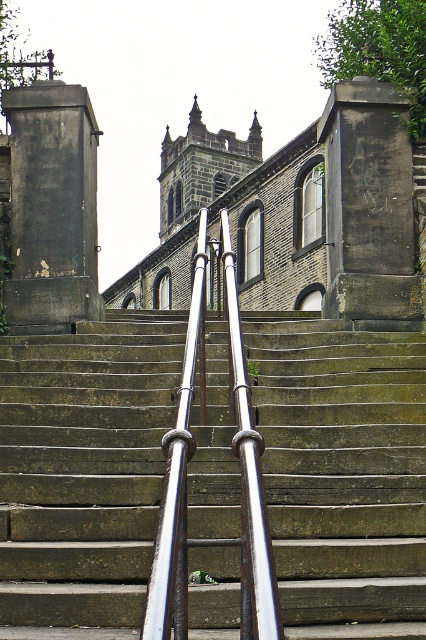
You are a painter hired to paint the rusty metal stairs at center and the silver metallic handrail at center. You have a limited amount of paint. Which object requires more paint due to its size?

The rusty metal stairs at center requires more paint because it has a larger size compared to the silver metallic handrail at center.

You are standing at the base of the historic building steps and want to reach the top. You notice two points marked on the steps. Which point, point [126,324] or point [199,308], is closer to you as you start climbing?

Point [126,324] is closer to you because it is further to the viewer than point [199,308], meaning it is nearer to your starting position at the base of the steps.

You are a maintenance worker needing to inspect both the rusty metal stairs at center and the silver metallic handrail at center. Which object is located below the other?

The rusty metal stairs at center is positioned under the silver metallic handrail at center, so the stairs are below the handrail.